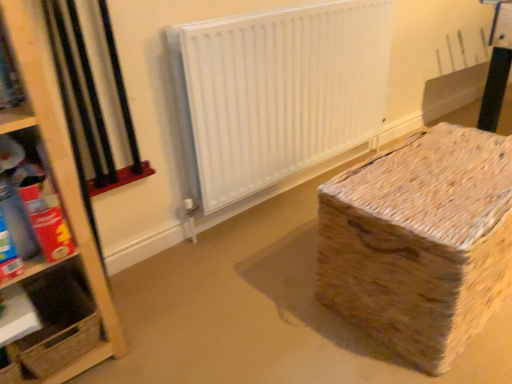
Question: From the image's perspective, does woven cardboard box at lower right appear higher than cardboard box at left, the 2th shelf from the bottom?

Choices:
 (A) no
 (B) yes

Answer: (A)

Question: Can you confirm if woven cardboard box at lower right is bigger than cardboard box at left, which is counted as the 1th shelf, starting from the top?

Choices:
 (A) no
 (B) yes

Answer: (B)

Question: Can you confirm if woven cardboard box at lower right is positioned to the right of cardboard box at left, which is counted as the 1th shelf, starting from the top?

Choices:
 (A) yes
 (B) no

Answer: (A)

Question: Is woven cardboard box at lower right in contact with cardboard box at left, which is counted as the 1th shelf, starting from the top?

Choices:
 (A) no
 (B) yes

Answer: (A)

Question: Does woven cardboard box at lower right have a greater width compared to cardboard box at left, which is counted as the 1th shelf, starting from the top?

Choices:
 (A) yes
 (B) no

Answer: (A)

Question: From a real-world perspective, is woven cardboard box at lower right on top of cardboard box at left, which is counted as the 1th shelf, starting from the top?

Choices:
 (A) no
 (B) yes

Answer: (A)

Question: Is cardboard box at left, which is counted as the 1th shelf, starting from the top, positioned with its back to wooden at left, which ranks as the first shelf in bottom-to-top order?

Choices:
 (A) yes
 (B) no

Answer: (B)

Question: Is cardboard box at left, the 2th shelf from the bottom, shorter than wooden at left, which ranks as the first shelf in bottom-to-top order?

Choices:
 (A) yes
 (B) no

Answer: (B)

Question: Can we say cardboard box at left, the 2th shelf from the bottom, lies outside wooden at left, the second shelf from the top?

Choices:
 (A) yes
 (B) no

Answer: (A)

Question: Considering the relative sizes of cardboard box at left, which is counted as the 1th shelf, starting from the top, and wooden at left, which ranks as the first shelf in bottom-to-top order, in the image provided, is cardboard box at left, which is counted as the 1th shelf, starting from the top, wider than wooden at left, which ranks as the first shelf in bottom-to-top order,?

Choices:
 (A) no
 (B) yes

Answer: (B)

Question: Considering the relative sizes of cardboard box at left, the 2th shelf from the bottom, and wooden at left, the second shelf from the top, in the image provided, is cardboard box at left, the 2th shelf from the bottom, bigger than wooden at left, the second shelf from the top,?

Choices:
 (A) yes
 (B) no

Answer: (B)

Question: Is cardboard box at left, which is counted as the 1th shelf, starting from the top, closer to camera compared to wooden at left, the second shelf from the top?

Choices:
 (A) yes
 (B) no

Answer: (A)

Question: Is white matte radiator at center aimed at wooden at left, the second shelf from the top?

Choices:
 (A) no
 (B) yes

Answer: (A)